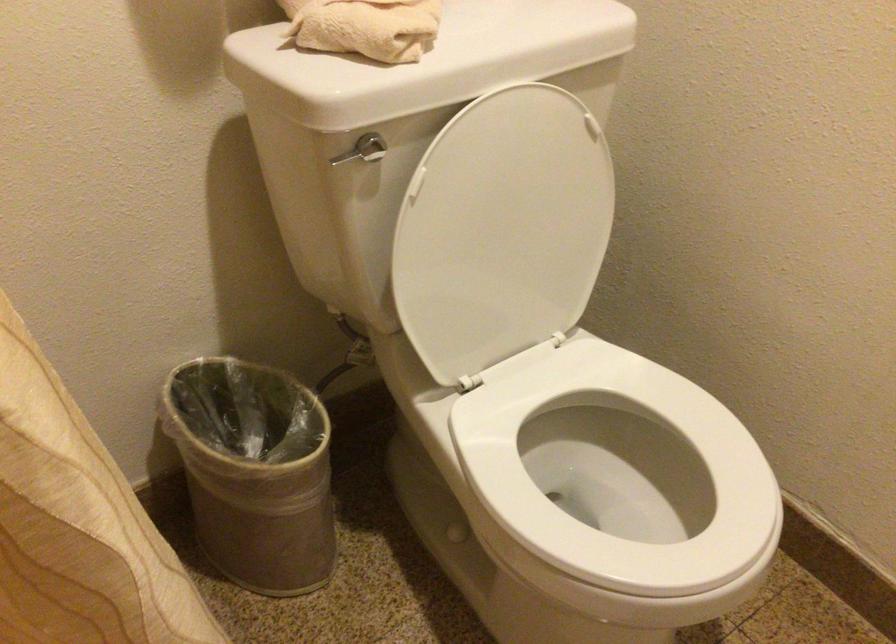
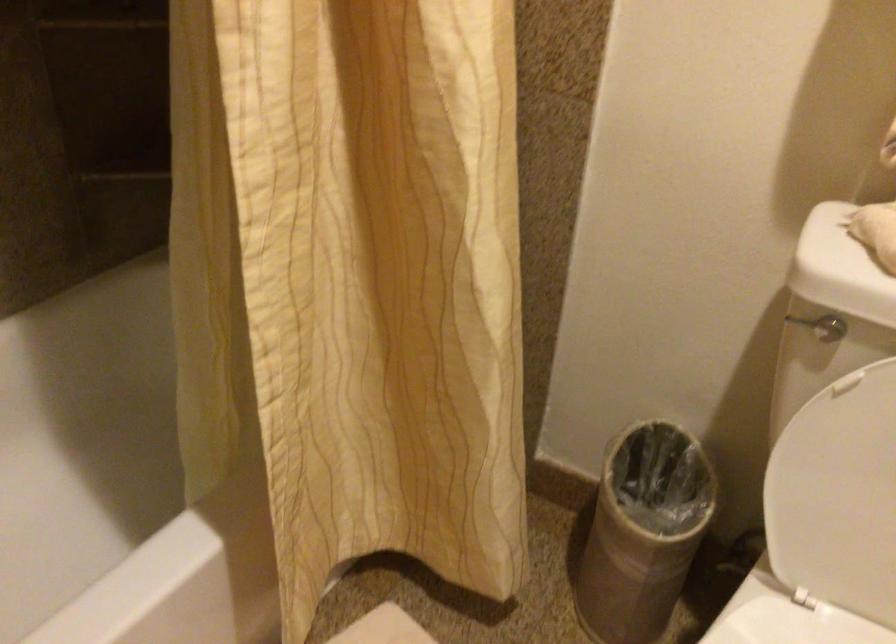
Question: The images are taken continuously from a first-person perspective. In which direction is your viewpoint rotating?

Choices:
 (A) Left
 (B) Right
 (C) Up
 (D) Down

Answer: (A)